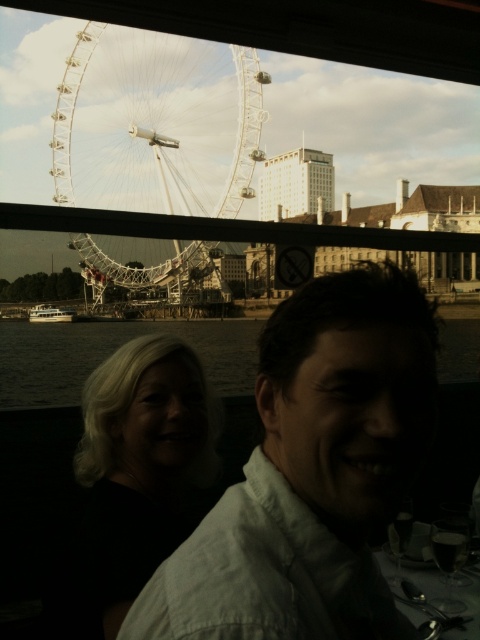
You are on a boat on the River Thames and want to take a photo of the white metallic ferris wheel at upper left and dark water at lower left. Which object should you focus on first if you want to capture both in one frame?

The white metallic ferris wheel at upper left is positioned on the left side of dark water at lower left, so you should focus on the white metallic ferris wheel at upper left first to ensure both are in frame.

You are navigating a small drone from the table towards the London Eye. The drone must pass through two checkpoints marked as point (184, 115) and point (252, 342). Which checkpoint should the drone reach first according to their spatial positions?

Point (252, 342) should be reached first because point (184, 115) is behind it, meaning the drone must pass through point (252, 342) first before reaching the one behind.

You are a photographer standing in the boat. You want to take a photo of the dark hair at lower left and the white glossy boat at lower left. Which object is wider?

The dark hair at lower left might be wider than white glossy boat at lower left, so the dark hair at lower left is wider.